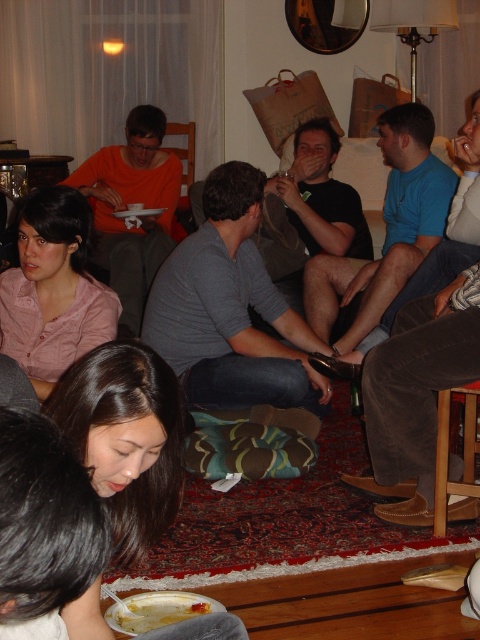
Between point (396, 314) and point (166, 614), which one is positioned in front?

Point (166, 614)

Where is `blue corduroy pants at lower right`? This screenshot has width=480, height=640. blue corduroy pants at lower right is located at coordinates (424, 356).